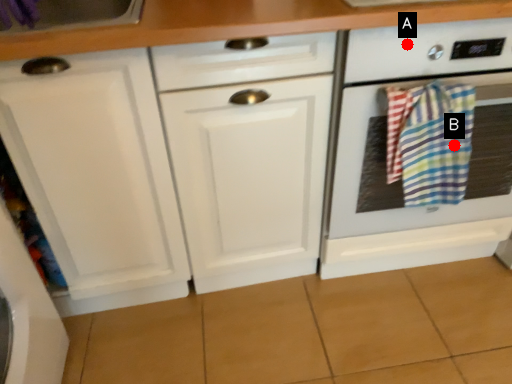
Question: Two points are circled on the image, labeled by A and B beside each circle. Which point is closer to the camera?

Choices:
 (A) A is closer
 (B) B is closer

Answer: (A)